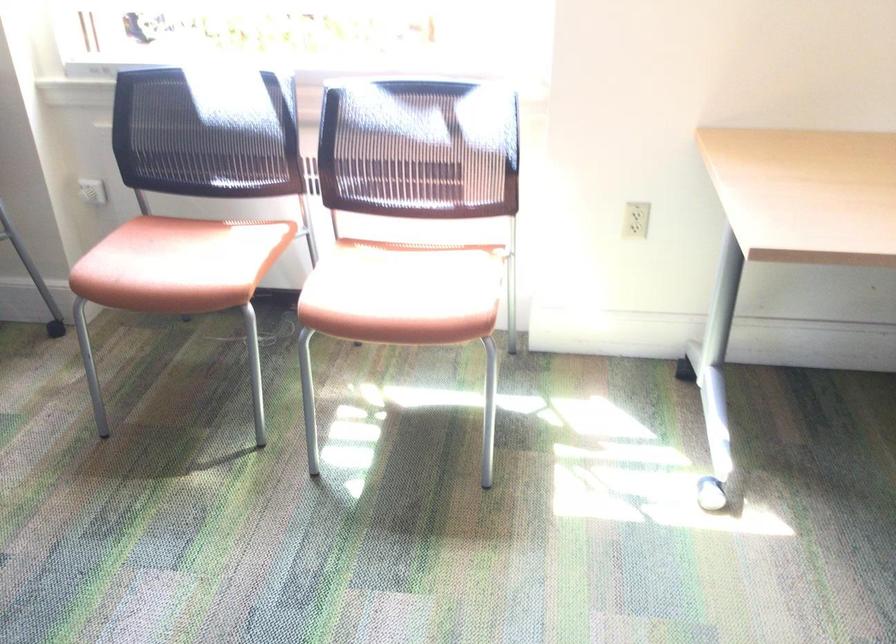
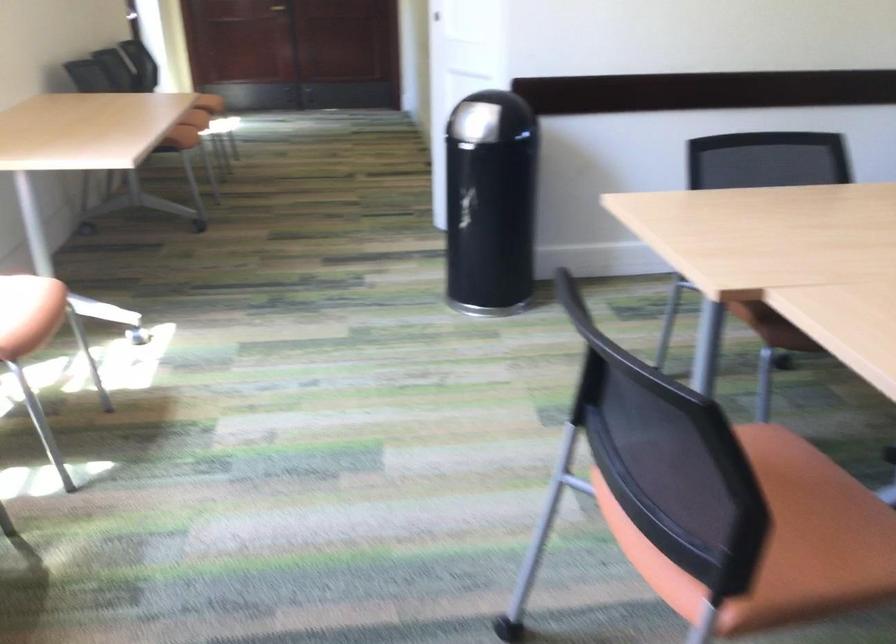
Where in the second image is the point corresponding to the point at 391,323 from the first image?

(40, 313)